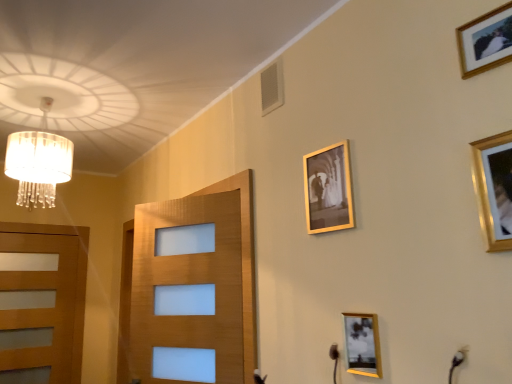
Question: Is gold metallic picture frame at upper center, which is the second picture frame in bottom-to-top order, beside gold metallic picture frame at upper right, arranged as the first picture frame when viewed from the front?

Choices:
 (A) no
 (B) yes

Answer: (A)

Question: Does gold metallic picture frame at upper center, the 3th picture frame when ordered from top to bottom, come behind gold metallic picture frame at upper right, the first picture frame viewed from the right?

Choices:
 (A) yes
 (B) no

Answer: (A)

Question: Is gold metallic picture frame at upper center, which is counted as the 4th picture frame, starting from the right, far away from gold metallic picture frame at upper right, the first picture frame viewed from the right?

Choices:
 (A) no
 (B) yes

Answer: (A)

Question: Does gold metallic picture frame at upper center, acting as the 1th picture frame starting from the left, have a smaller size compared to gold metallic picture frame at upper right, placed as the 4th picture frame when sorted from left to right?

Choices:
 (A) yes
 (B) no

Answer: (B)

Question: Is gold metallic picture frame at upper center, which ranks as the 1th picture frame in back-to-front order, positioned with its back to gold metallic picture frame at upper right, which is the 2th picture frame in top-to-bottom order?

Choices:
 (A) yes
 (B) no

Answer: (B)

Question: Does gold metallic picture frame at upper center, which is counted as the 4th picture frame, starting from the right, have a lesser width compared to gold metallic picture frame at upper right, arranged as the first picture frame when viewed from the front?

Choices:
 (A) yes
 (B) no

Answer: (B)

Question: Is gold-framed photo at upper right, the third picture frame in the back-to-front sequence, oriented towards gold metallic picture frame at upper right, placed as the 4th picture frame when sorted from left to right?

Choices:
 (A) no
 (B) yes

Answer: (A)

Question: Is gold-framed photo at upper right, arranged as the 2th picture frame when viewed from the front, further to the viewer compared to gold metallic picture frame at upper right, which is the 2th picture frame in top-to-bottom order?

Choices:
 (A) no
 (B) yes

Answer: (B)

Question: Is gold metallic picture frame at upper right, arranged as the first picture frame when viewed from the front, located within gold-framed photo at upper right, arranged as the third picture frame when viewed from the left?

Choices:
 (A) yes
 (B) no

Answer: (B)

Question: Considering the relative sizes of gold-framed photo at upper right, which is counted as the second picture frame, starting from the right, and gold metallic picture frame at upper right, arranged as the first picture frame when viewed from the front, in the image provided, is gold-framed photo at upper right, which is counted as the second picture frame, starting from the right, bigger than gold metallic picture frame at upper right, arranged as the first picture frame when viewed from the front,?

Choices:
 (A) yes
 (B) no

Answer: (B)

Question: Does gold-framed photo at upper right, arranged as the third picture frame when viewed from the left, have a greater width compared to gold metallic picture frame at upper right, placed as the 4th picture frame when sorted from left to right?

Choices:
 (A) yes
 (B) no

Answer: (A)

Question: Is gold-framed photo at upper right, the 1th picture frame positioned from the top, thinner than gold metallic picture frame at upper right, the first picture frame viewed from the right?

Choices:
 (A) no
 (B) yes

Answer: (A)

Question: Would you consider wooden door at left to be distant from gold-framed photo at upper right, arranged as the third picture frame when viewed from the left?

Choices:
 (A) no
 (B) yes

Answer: (B)